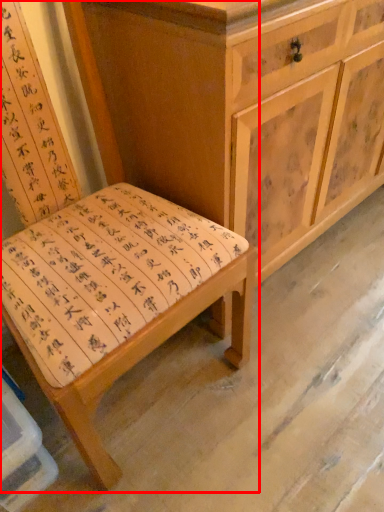
Question: From the image's perspective, where is chair (annotated by the red box) located in relation to chest of drawers in the image?

Choices:
 (A) below
 (B) above

Answer: (A)